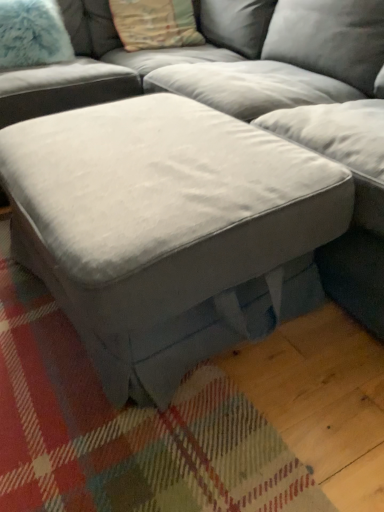
Question: Is textured beige pillow at upper center, the second pillow positioned from the left, shorter than suede gray ottoman at center?

Choices:
 (A) no
 (B) yes

Answer: (B)

Question: Can suede gray ottoman at center be found inside textured beige pillow at upper center, the second pillow positioned from the left?

Choices:
 (A) yes
 (B) no

Answer: (B)

Question: Is the depth of textured beige pillow at upper center, the second pillow positioned from the left, greater than that of suede gray ottoman at center?

Choices:
 (A) no
 (B) yes

Answer: (B)

Question: Can you confirm if textured beige pillow at upper center, the second pillow positioned from the left, is wider than suede gray ottoman at center?

Choices:
 (A) yes
 (B) no

Answer: (B)

Question: Considering the relative positions of textured beige pillow at upper center, arranged as the 1th pillow when viewed from the right, and suede gray ottoman at center in the image provided, is textured beige pillow at upper center, arranged as the 1th pillow when viewed from the right, to the right of suede gray ottoman at center from the viewer's perspective?

Choices:
 (A) yes
 (B) no

Answer: (B)

Question: Considering the positions of textured beige pillow at upper center, the second pillow positioned from the left, and suede gray ottoman at center in the image, is textured beige pillow at upper center, the second pillow positioned from the left, taller or shorter than suede gray ottoman at center?

Choices:
 (A) short
 (B) tall

Answer: (A)

Question: Considering the relative positions of textured beige pillow at upper center, arranged as the 1th pillow when viewed from the right, and suede gray ottoman at center in the image provided, is textured beige pillow at upper center, arranged as the 1th pillow when viewed from the right, to the left or to the right of suede gray ottoman at center?

Choices:
 (A) right
 (B) left

Answer: (B)

Question: Is point (162, 10) positioned closer to the camera than point (215, 89)?

Choices:
 (A) closer
 (B) farther

Answer: (B)

Question: From a real-world perspective, is textured beige pillow at upper center, the second pillow positioned from the left, positioned above or below suede gray ottoman at center?

Choices:
 (A) above
 (B) below

Answer: (A)

Question: In the image, is suede gray ottoman at center positioned in front of or behind textured beige pillow at upper center, arranged as the 1th pillow when viewed from the right?

Choices:
 (A) behind
 (B) front

Answer: (B)

Question: Is suede gray ottoman at center situated inside textured beige pillow at upper center, the second pillow positioned from the left, or outside?

Choices:
 (A) outside
 (B) inside

Answer: (A)

Question: From the image's perspective, is suede gray ottoman at center located above or below textured beige pillow at upper center, the second pillow positioned from the left?

Choices:
 (A) below
 (B) above

Answer: (A)

Question: Considering the positions of suede gray ottoman at center and textured beige pillow at upper center, arranged as the 1th pillow when viewed from the right, in the image, is suede gray ottoman at center wider or thinner than textured beige pillow at upper center, arranged as the 1th pillow when viewed from the right,?

Choices:
 (A) thin
 (B) wide

Answer: (B)

Question: Is point (29, 4) closer or farther from the camera than point (331, 41)?

Choices:
 (A) farther
 (B) closer

Answer: (A)

Question: Looking at the image, does fuzzy white pillow at upper left, the 2th pillow viewed from the right, seem bigger or smaller compared to suede gray ottoman at center?

Choices:
 (A) big
 (B) small

Answer: (B)